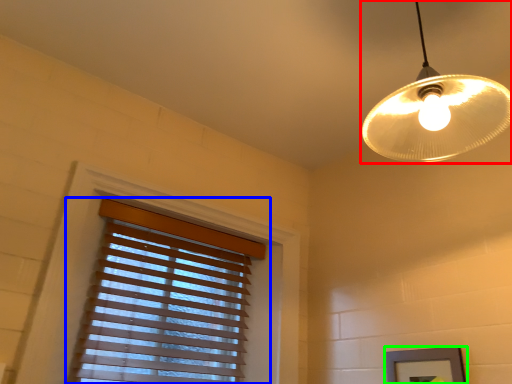
Question: Considering the real-world distances, which object is farthest from lamp (highlighted by a red box)? window blind (highlighted by a blue box) or picture frame (highlighted by a green box)?

Choices:
 (A) window blind
 (B) picture frame

Answer: (A)